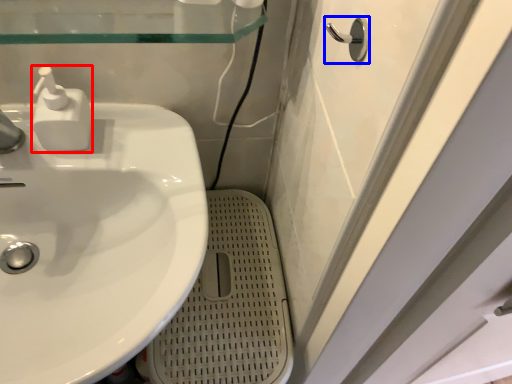
Question: Which object appears farthest to the camera in this image, soap dispenser (highlighted by a red box) or door handle (highlighted by a blue box)?

Choices:
 (A) soap dispenser
 (B) door handle

Answer: (A)